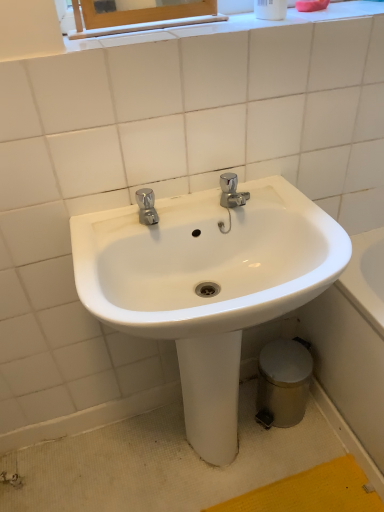
Question: Can you confirm if silver metallic trash can at lower right is wider than white glossy sink at center?

Choices:
 (A) no
 (B) yes

Answer: (A)

Question: Is silver metallic trash can at lower right next to white glossy sink at center?

Choices:
 (A) no
 (B) yes

Answer: (A)

Question: Is silver metallic trash can at lower right to the right of white glossy sink at center from the viewer's perspective?

Choices:
 (A) no
 (B) yes

Answer: (B)

Question: Can you confirm if silver metallic trash can at lower right is taller than white glossy sink at center?

Choices:
 (A) no
 (B) yes

Answer: (A)

Question: From a real-world perspective, is silver metallic trash can at lower right physically above white glossy sink at center?

Choices:
 (A) yes
 (B) no

Answer: (B)

Question: Is silver metallic trash can at lower right further to camera compared to white glossy sink at center?

Choices:
 (A) no
 (B) yes

Answer: (B)

Question: Is white glossy sink at center facing away from silver metallic trash can at lower right?

Choices:
 (A) yes
 (B) no

Answer: (B)

Question: Could you tell me if white glossy sink at center is facing silver metallic trash can at lower right?

Choices:
 (A) yes
 (B) no

Answer: (B)

Question: From a real-world perspective, does white glossy sink at center sit lower than silver metallic trash can at lower right?

Choices:
 (A) no
 (B) yes

Answer: (A)

Question: Can you confirm if white glossy sink at center is shorter than silver metallic trash can at lower right?

Choices:
 (A) no
 (B) yes

Answer: (A)

Question: Is the surface of white glossy sink at center in direct contact with silver metallic trash can at lower right?

Choices:
 (A) no
 (B) yes

Answer: (A)

Question: From the image's perspective, does white glossy sink at center appear lower than silver metallic trash can at lower right?

Choices:
 (A) no
 (B) yes

Answer: (A)

Question: Relative to white glossy sink at center, is silver metallic trash can at lower right in front or behind?

Choices:
 (A) front
 (B) behind

Answer: (B)